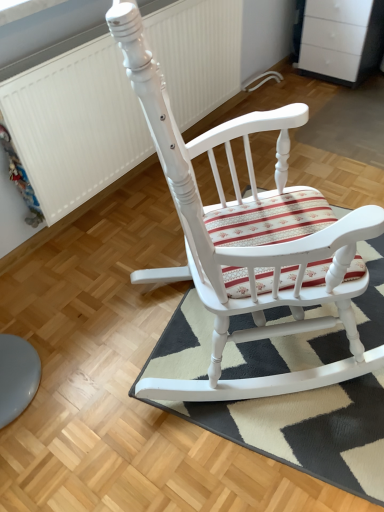
Question: Should I look upward or downward to see striped fabric doormat at center?

Choices:
 (A) down
 (B) up

Answer: (A)

Question: Would you consider white painted wood rocking chair at center to be distant from striped fabric doormat at center?

Choices:
 (A) no
 (B) yes

Answer: (A)

Question: From the image's perspective, is white painted wood rocking chair at center beneath striped fabric doormat at center?

Choices:
 (A) no
 (B) yes

Answer: (A)

Question: Is striped fabric doormat at center surrounded by white painted wood rocking chair at center?

Choices:
 (A) no
 (B) yes

Answer: (A)

Question: Is white painted wood rocking chair at center in front of striped fabric doormat at center?

Choices:
 (A) yes
 (B) no

Answer: (A)

Question: From a real-world perspective, does white painted wood rocking chair at center stand above striped fabric doormat at center?

Choices:
 (A) no
 (B) yes

Answer: (B)

Question: Is white painted wood rocking chair at center aimed at striped fabric doormat at center?

Choices:
 (A) yes
 (B) no

Answer: (B)

Question: Is white painted wood rocking chair at center placed right next to white textured radiator at upper left?

Choices:
 (A) no
 (B) yes

Answer: (A)

Question: Would you say white painted wood rocking chair at center is a long distance from white textured radiator at upper left?

Choices:
 (A) no
 (B) yes

Answer: (A)

Question: Is white painted wood rocking chair at center oriented away from white textured radiator at upper left?

Choices:
 (A) no
 (B) yes

Answer: (A)

Question: Does white painted wood rocking chair at center have a larger size compared to white textured radiator at upper left?

Choices:
 (A) yes
 (B) no

Answer: (A)

Question: Can we say white painted wood rocking chair at center lies outside white textured radiator at upper left?

Choices:
 (A) no
 (B) yes

Answer: (B)

Question: From the image's perspective, would you say white painted wood rocking chair at center is shown under white textured radiator at upper left?

Choices:
 (A) no
 (B) yes

Answer: (B)

Question: Is white textured radiator at upper left smaller than white painted wood rocking chair at center?

Choices:
 (A) yes
 (B) no

Answer: (A)